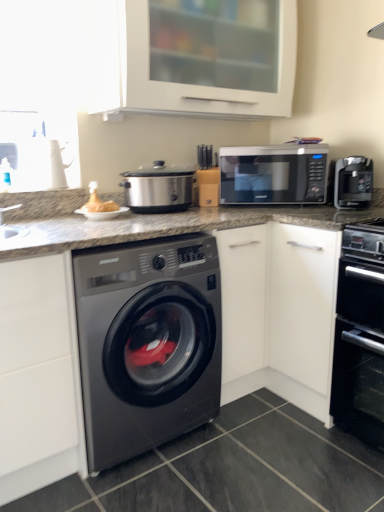
Question: Is satin silver slow cooker at center spatially inside black matte microwave at upper right, or outside of it?

Choices:
 (A) outside
 (B) inside

Answer: (A)

Question: Considering the positions of point (135, 184) and point (289, 166), is point (135, 184) closer or farther from the camera than point (289, 166)?

Choices:
 (A) closer
 (B) farther

Answer: (A)

Question: Based on their relative distances, which object is nearer to the sleek black coffee maker at right?

Choices:
 (A) black matte microwave at upper right
 (B) black matte oven at lower right
 (C) white matte cabinet at upper center
 (D) matte brown bread at upper left
 (E) satin black washing machine at center

Answer: (A)

Question: Considering the real-world distances, which object is farthest from the black matte microwave at upper right?

Choices:
 (A) matte brown bread at upper left
 (B) black matte oven at lower right
 (C) satin silver slow cooker at center
 (D) satin black washing machine at center
 (E) sleek black coffee maker at right

Answer: (D)